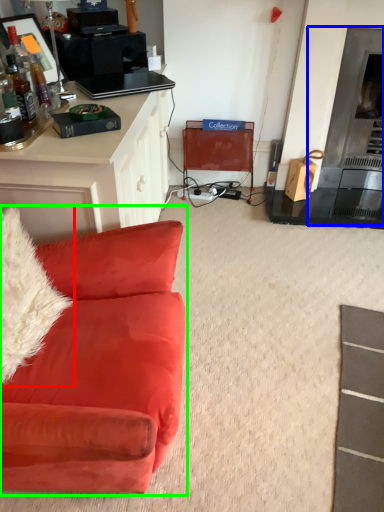
Question: Which is farther away from pillow (highlighted by a red box)? fireplace (highlighted by a blue box) or studio couch (highlighted by a green box)?

Choices:
 (A) fireplace
 (B) studio couch

Answer: (A)